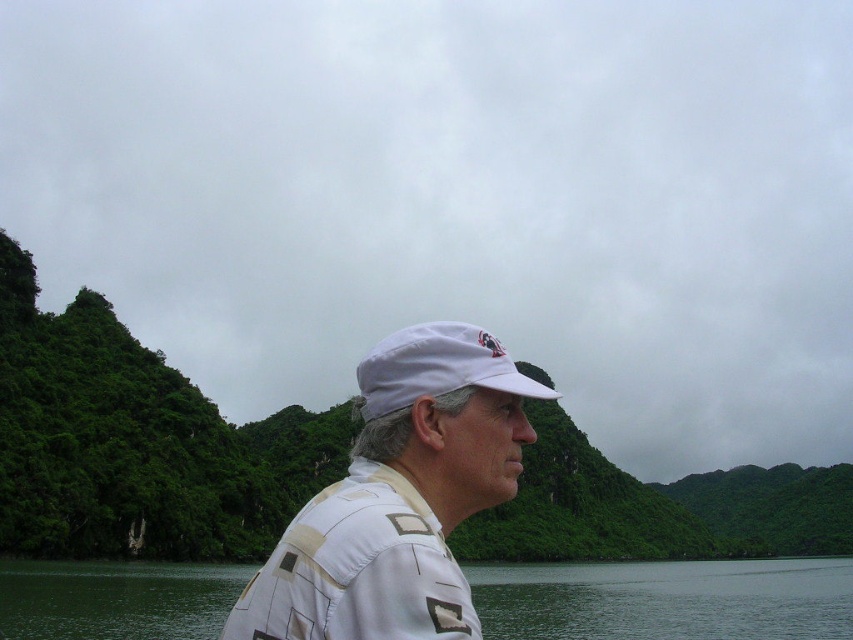
Does white matte cap at center have a larger size compared to white fabric cap at center?

Indeed, white matte cap at center has a larger size compared to white fabric cap at center.

Does white matte cap at center have a lesser width compared to white fabric cap at center?

No.

The image size is (853, 640). What do you see at coordinates (399, 497) in the screenshot?
I see `white matte cap at center` at bounding box center [399, 497].

I want to click on white matte cap at center, so [399, 497].

The height and width of the screenshot is (640, 853). What do you see at coordinates (399, 497) in the screenshot?
I see `white matte cap at center` at bounding box center [399, 497].

This screenshot has height=640, width=853. I want to click on white matte cap at center, so click(399, 497).

Which is behind, point (47, 595) or point (500, 374)?

The point (47, 595) is more distant.

Looking at this image, is transparent water at center further to camera compared to white fabric cap at center?

Yes, transparent water at center is behind white fabric cap at center.

Is point (569, 598) positioned after point (459, 381)?

Yes, point (569, 598) is behind point (459, 381).

I want to click on transparent water at center, so click(x=666, y=600).